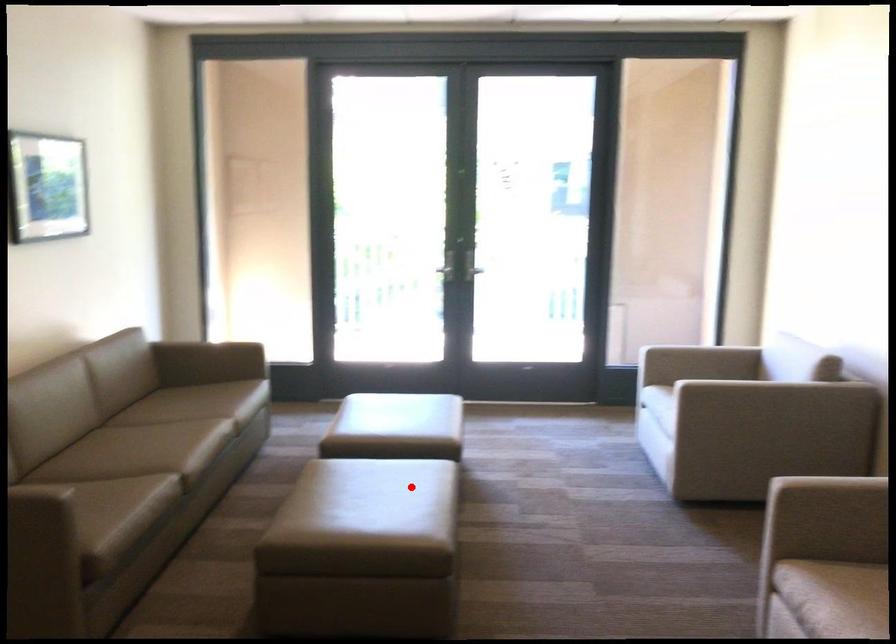
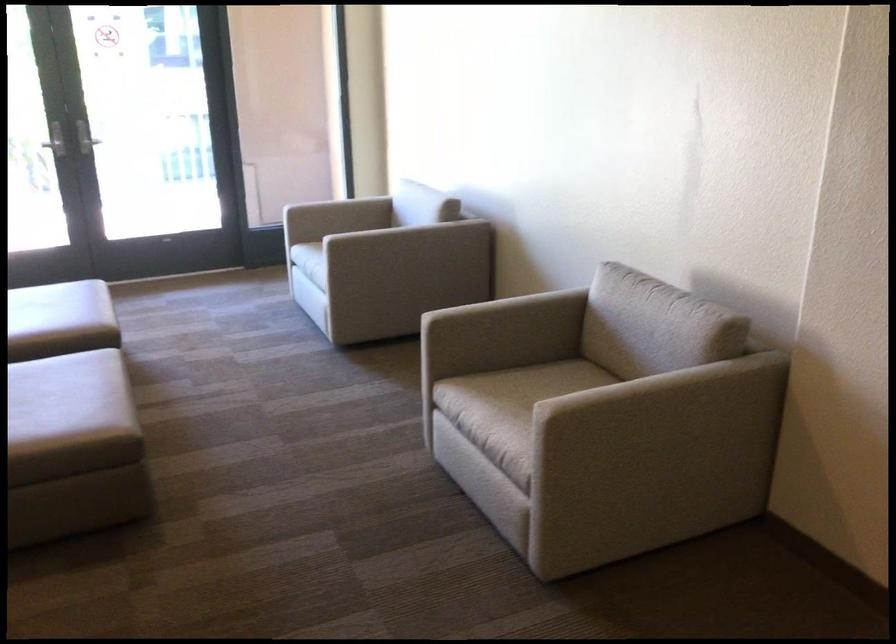
In the second image, find the point that corresponds to the highlighted location in the first image.

(65, 384)